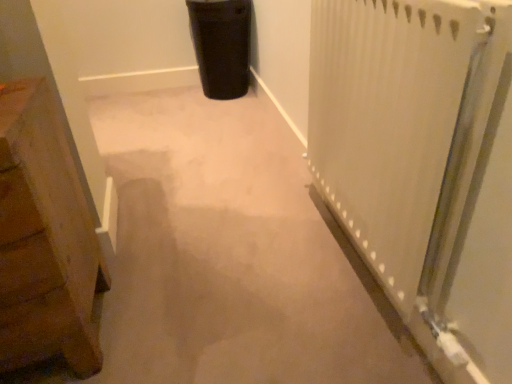
Describe the element at coordinates (221, 45) in the screenshot. I see `black matte trash can at upper center` at that location.

Describe the element at coordinates (44, 239) in the screenshot. I see `wooden chest at left` at that location.

Measure the distance between point (444, 86) and camera.

Point (444, 86) is 75.30 centimeters from camera.

The width and height of the screenshot is (512, 384). I want to click on black matte trash can at upper center, so click(221, 45).

Is black matte trash can at upper center located within white textured radiator at right?

Definitely not — black matte trash can at upper center is not inside white textured radiator at right.

Who is shorter, white textured radiator at right or black matte trash can at upper center?

With less height is black matte trash can at upper center.

Is white textured radiator at right at the right side of black matte trash can at upper center?

Indeed, white textured radiator at right is positioned on the right side of black matte trash can at upper center.

Would you consider white textured radiator at right to be distant from black matte trash can at upper center?

Yes, white textured radiator at right and black matte trash can at upper center are located far from each other.

Is wooden chest at left at the back of black matte trash can at upper center?

No.

Based on the photo, is black matte trash can at upper center positioned far away from wooden chest at left?

Absolutely, black matte trash can at upper center is distant from wooden chest at left.

Is black matte trash can at upper center wider than wooden chest at left?

No, black matte trash can at upper center is not wider than wooden chest at left.

Is point (244, 86) farther from viewer compared to point (13, 268)?

Yes, point (244, 86) is farther from viewer.

In terms of height, does white textured radiator at right look taller or shorter compared to wooden chest at left?

white textured radiator at right is taller than wooden chest at left.

Considering the relative positions of white textured radiator at right and wooden chest at left in the image provided, is white textured radiator at right to the left or to the right of wooden chest at left?

In the image, white textured radiator at right appears on the right side of wooden chest at left.

Consider the image. Can you confirm if white textured radiator at right is bigger than wooden chest at left?

No, white textured radiator at right is not bigger than wooden chest at left.

Can you confirm if white textured radiator at right is thinner than wooden chest at left?

Yes, white textured radiator at right is thinner than wooden chest at left.

Which object is closer to the camera, wooden chest at left or black matte trash can at upper center?

wooden chest at left.

Between wooden chest at left and black matte trash can at upper center, which one appears on the left side from the viewer's perspective?

wooden chest at left is more to the left.

Does point (8, 159) come in front of point (224, 98)?

Yes, point (8, 159) is closer to viewer.

How many degrees apart are the facing directions of wooden chest at left and black matte trash can at upper center?

The angular difference between wooden chest at left and black matte trash can at upper center is 2.43 degrees.

Measure the distance between black matte trash can at upper center and white textured radiator at right.

black matte trash can at upper center is 1.52 meters away from white textured radiator at right.

Consider the image. Considering the sizes of objects black matte trash can at upper center and white textured radiator at right in the image provided, who is taller, black matte trash can at upper center or white textured radiator at right?

white textured radiator at right is taller.

Which is in front, point (207, 36) or point (311, 88)?

Positioned in front is point (311, 88).

Is wooden chest at left situated inside white textured radiator at right or outside?

wooden chest at left is located beyond the bounds of white textured radiator at right.

How distant is wooden chest at left from white textured radiator at right?

wooden chest at left is 31.49 inches away from white textured radiator at right.

Is point (25, 123) behind point (423, 267)?

No, it is not.

Who is smaller, wooden chest at left or white textured radiator at right?

white textured radiator at right is smaller.

The image size is (512, 384). Identify the location of garbage above the white textured radiator at right (from the image's perspective). (221, 45).

You are a GUI agent. You are given a task and a screenshot of the screen. Output one action in this format:
    pyautogui.click(x=<x>, y=<y>)
    Task: Click on the furniture located on the left of black matte trash can at upper center
    The height and width of the screenshot is (384, 512).
    Given the screenshot: What is the action you would take?
    pyautogui.click(x=44, y=239)

Considering their positions, is white textured radiator at right positioned closer to black matte trash can at upper center than wooden chest at left?

The object closer to black matte trash can at upper center is white textured radiator at right.

When comparing their distances from black matte trash can at upper center, does wooden chest at left or white textured radiator at right seem closer?

The object closer to black matte trash can at upper center is white textured radiator at right.

When comparing their distances from white textured radiator at right, does wooden chest at left or black matte trash can at upper center seem closer?

Among the two, wooden chest at left is located nearer to white textured radiator at right.

Looking at the image, which one is located closer to wooden chest at left, black matte trash can at upper center or white textured radiator at right?

The object closer to wooden chest at left is white textured radiator at right.

Considering their positions, is white textured radiator at right positioned closer to wooden chest at left than black matte trash can at upper center?

Based on the image, white textured radiator at right appears to be nearer to wooden chest at left.

From the picture: Estimate the real-world distances between objects in this image. Which object is further from white textured radiator at right, black matte trash can at upper center or wooden chest at left?

Based on the image, black matte trash can at upper center appears to be further to white textured radiator at right.

Find the location of a particular element. This screenshot has width=512, height=384. furniture positioned between white textured radiator at right and black matte trash can at upper center from near to far is located at coordinates (44, 239).